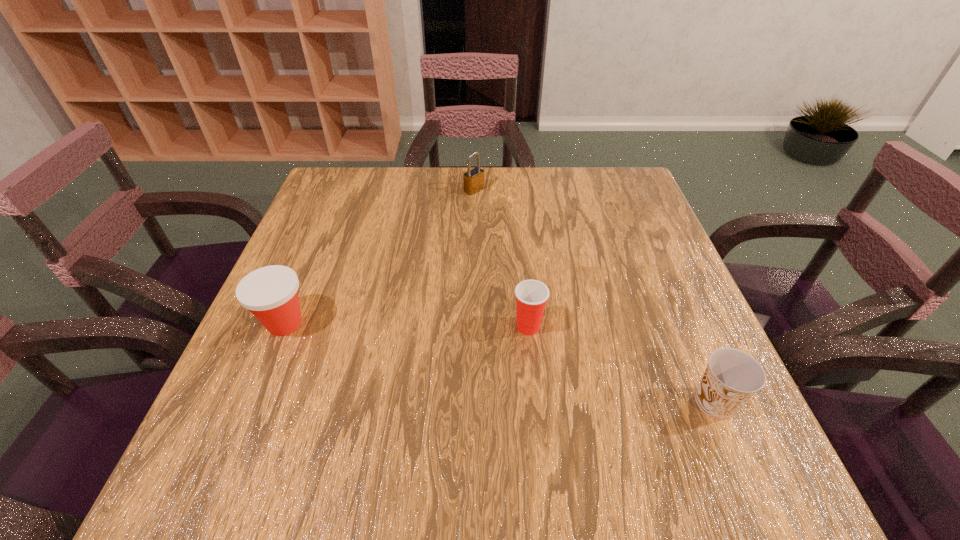
Locate an element on the screen. Dixie cup that is the closest to the padlock is located at coordinates (531, 296).

What are the coordinates of `Dixie cup that is the second nearest to the leftmost object` in the screenshot? It's located at (732, 377).

Identify the location of free point that satisfies the following two spatial constraints: 1. on the back side of the second object from left to right; 2. on the left side of the leftmost Dixie cup. (340, 190).

Where is `vacant space that satisfies the following two spatial constraints: 1. on the front side of the nearest Dixie cup; 2. on the left side of the padlock`? The height and width of the screenshot is (540, 960). vacant space that satisfies the following two spatial constraints: 1. on the front side of the nearest Dixie cup; 2. on the left side of the padlock is located at coordinates (470, 403).